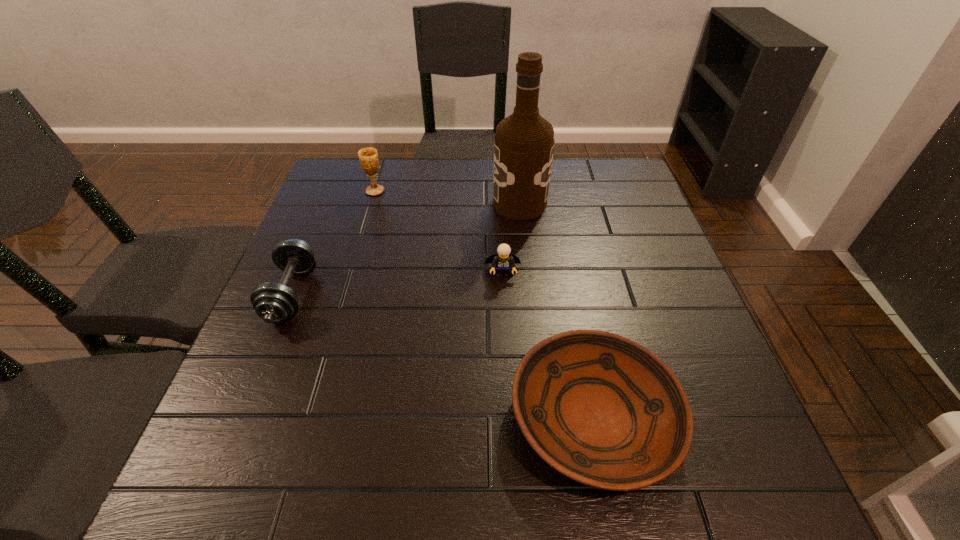
Identify the location of object that is positioned at the far left corner. This screenshot has width=960, height=540. (368, 157).

You are a GUI agent. You are given a task and a screenshot of the screen. Output one action in this format:
    pyautogui.click(x=<x>, y=<y>)
    Task: Click on the object positioned at the near right corner
    The height and width of the screenshot is (540, 960).
    Given the screenshot: What is the action you would take?
    pyautogui.click(x=604, y=411)

Locate an element on the screen. Image resolution: width=960 pixels, height=540 pixels. vacant region at the far edge is located at coordinates (402, 177).

Image resolution: width=960 pixels, height=540 pixels. What are the coordinates of `vacant space at the near edge` in the screenshot? It's located at (318, 456).

At what (x,y) coordinates should I click in order to perform the action: click on free space at the left edge of the desktop. Please return your answer as a coordinate pair (x, y). Looking at the image, I should click on (294, 427).

The height and width of the screenshot is (540, 960). In order to click on free point at the right edge in this screenshot , I will do `click(623, 226)`.

The height and width of the screenshot is (540, 960). In the image, there is a desktop. What are the coordinates of `free space at the far left corner` in the screenshot? It's located at (370, 204).

This screenshot has height=540, width=960. What are the coordinates of `free region at the near left corner` in the screenshot? It's located at (218, 465).

Locate an element on the screen. free space at the near right corner is located at coordinates (760, 500).

Locate an element on the screen. The image size is (960, 540). free space between the second tallest object and the plate is located at coordinates (485, 304).